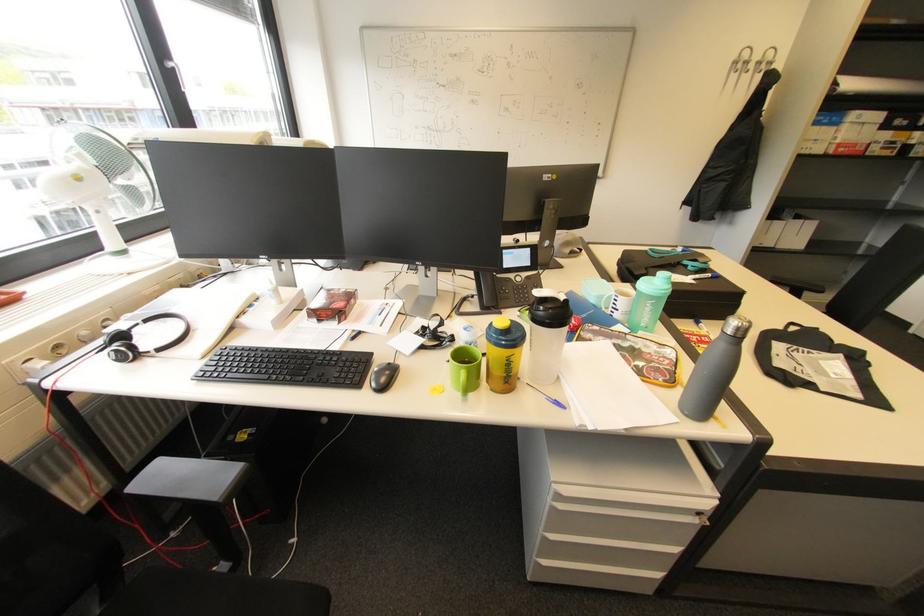
Find where to lift the grey metal bottle. Please return your answer as a coordinate pair (x, y).

(713, 371)